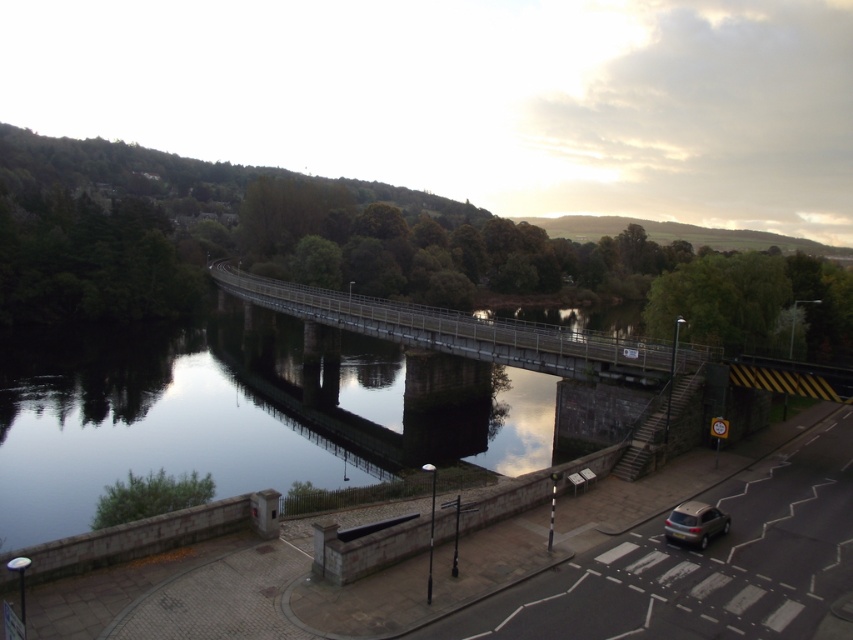
Is reflective concrete water at center above metallic gray bridge at center?

Actually, reflective concrete water at center is below metallic gray bridge at center.

Which is more to the left, reflective concrete water at center or metallic gray bridge at center?

Positioned to the left is metallic gray bridge at center.

Describe the element at coordinates (231, 417) in the screenshot. I see `reflective concrete water at center` at that location.

Identify the location of reflective concrete water at center. (231, 417).

Is metallic gray bridge at center above satin silver car at lower right?

Yes.

Describe the element at coordinates (457, 330) in the screenshot. The width and height of the screenshot is (853, 640). I see `metallic gray bridge at center` at that location.

Locate an element on the screen. The width and height of the screenshot is (853, 640). metallic gray bridge at center is located at coordinates pyautogui.click(x=457, y=330).

Can you confirm if reflective concrete water at center is positioned to the right of satin silver car at lower right?

Incorrect, reflective concrete water at center is not on the right side of satin silver car at lower right.

Does reflective concrete water at center appear under satin silver car at lower right?

No.

What do you see at coordinates (231, 417) in the screenshot? The image size is (853, 640). I see `reflective concrete water at center` at bounding box center [231, 417].

The image size is (853, 640). Find the location of `reflective concrete water at center`. reflective concrete water at center is located at coordinates (231, 417).